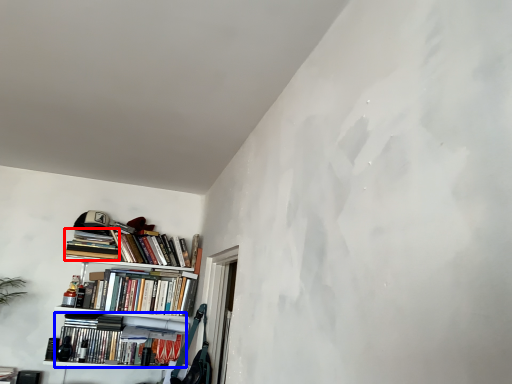
Question: Which object is closer to the camera taking this photo, book (highlighted by a red box) or book (highlighted by a blue box)?

Choices:
 (A) book
 (B) book

Answer: (B)